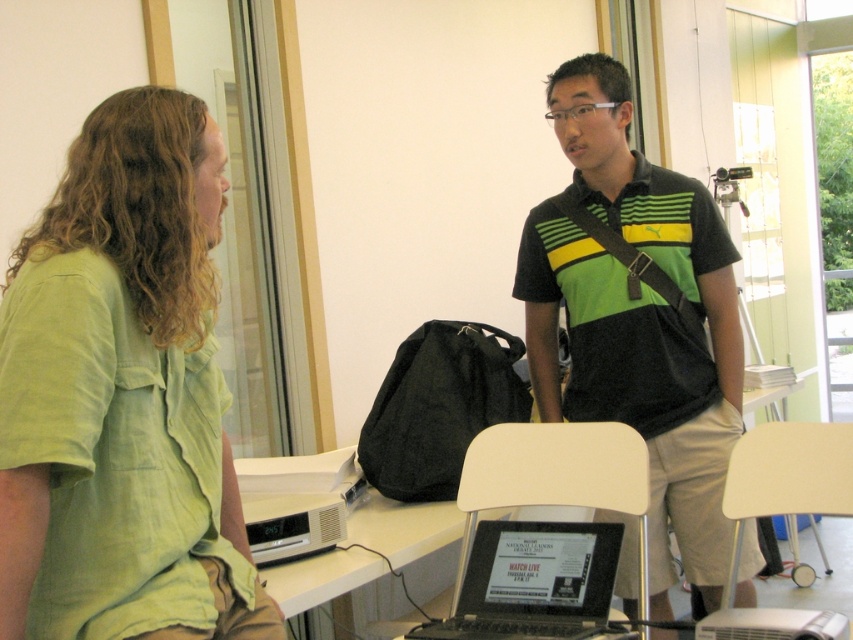
Based on the photo, does green cotton shirt at left appear on the left side of green striped polo shirt at center?

Indeed, green cotton shirt at left is positioned on the left side of green striped polo shirt at center.

Does green cotton shirt at left have a larger size compared to green striped polo shirt at center?

No.

Find the location of a particular element. This screenshot has height=640, width=853. green cotton shirt at left is located at coordinates (122, 396).

The image size is (853, 640). I want to click on green cotton shirt at left, so click(x=122, y=396).

From the picture: Is green cotton shirt at left above black glossy laptop at lower center?

Correct, green cotton shirt at left is located above black glossy laptop at lower center.

Who is positioned more to the right, green cotton shirt at left or black glossy laptop at lower center?

From the viewer's perspective, black glossy laptop at lower center appears more on the right side.

Identify the location of green cotton shirt at left. (122, 396).

The image size is (853, 640). I want to click on green cotton shirt at left, so click(x=122, y=396).

Looking at this image, who is shorter, green striped polo shirt at center or black glossy laptop at lower center?

With less height is black glossy laptop at lower center.

Between green striped polo shirt at center and black glossy laptop at lower center, which one appears on the left side from the viewer's perspective?

black glossy laptop at lower center is more to the left.

At what (x,y) coordinates should I click in order to perform the action: click on green striped polo shirt at center. Please return your answer as a coordinate pair (x, y). Looking at the image, I should click on (637, 317).